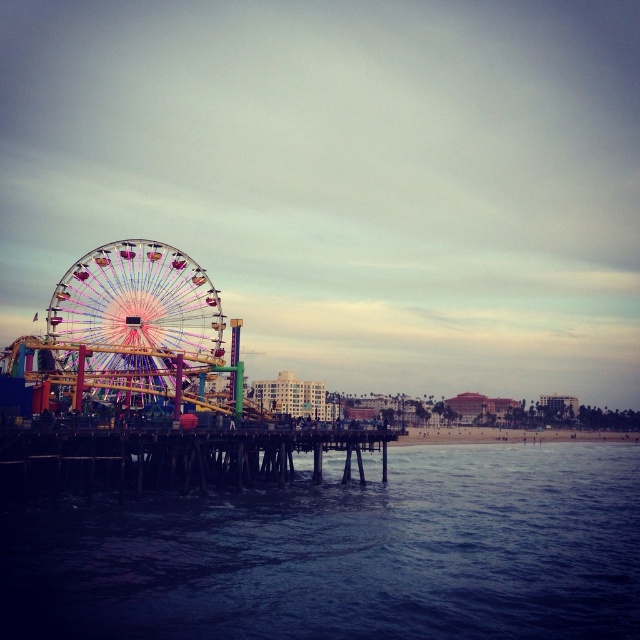
Question: Which point appears closest to the camera in this image?

Choices:
 (A) (x=611, y=525)
 (B) (x=84, y=285)
 (C) (x=172, y=477)
 (D) (x=552, y=429)

Answer: (A)

Question: Can you confirm if multicolored metallic ferris wheel at left is bigger than sandy beach at lower center?

Choices:
 (A) no
 (B) yes

Answer: (B)

Question: Considering the relative positions of dark blue water at lower center and sandy beach at lower center in the image provided, where is dark blue water at lower center located with respect to sandy beach at lower center?

Choices:
 (A) below
 (B) above

Answer: (A)

Question: Which object is closer to the camera taking this photo?

Choices:
 (A) wooden at center
 (B) multicolored metallic ferris wheel at left

Answer: (A)

Question: Estimate the real-world distances between objects in this image. Which object is farther from the dark blue water at lower center?

Choices:
 (A) multicolored metallic ferris wheel at left
 (B) sandy beach at lower center

Answer: (B)

Question: Can you confirm if dark blue water at lower center is positioned below sandy beach at lower center?

Choices:
 (A) no
 (B) yes

Answer: (B)